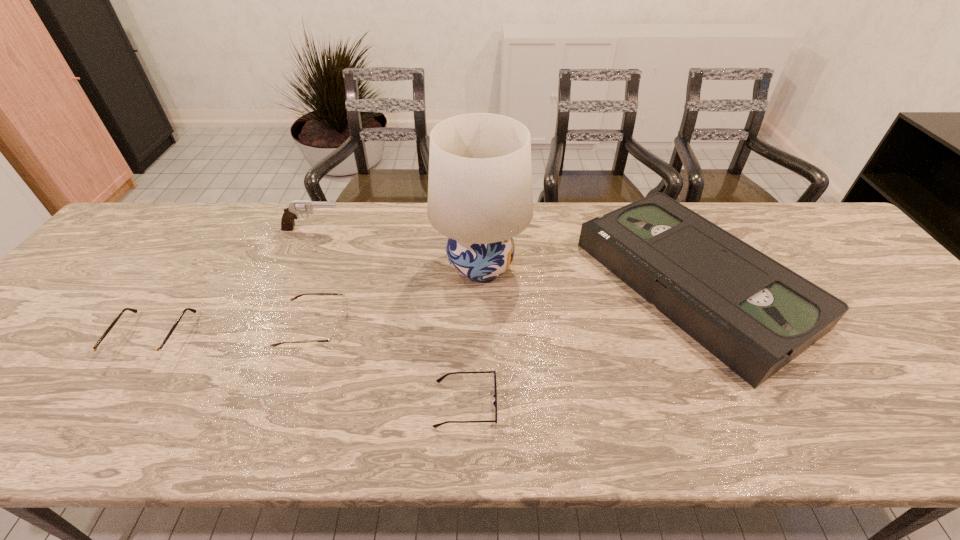
I want to click on free space located at the muzzle of the gun, so click(474, 230).

At what (x,y) coordinates should I click in order to perform the action: click on free spot located 0.100m on the right of the fourth shortest object. Please return your answer as a coordinate pair (x, y). Looking at the image, I should click on (836, 284).

At what (x,y) coordinates should I click in order to perform the action: click on free region located 0.150m at the hinge ends of the leftmost spectacles. Please return your answer as a coordinate pair (x, y). The width and height of the screenshot is (960, 540). Looking at the image, I should click on (92, 427).

Find the location of a particular element. vacant region located 0.390m on the front-facing side of the second spectacles from left to right is located at coordinates coord(508,328).

The width and height of the screenshot is (960, 540). Find the location of `vacant space located 0.210m on the front-facing side of the rightmost spectacles`. vacant space located 0.210m on the front-facing side of the rightmost spectacles is located at coordinates (598, 404).

Locate an element on the screen. This screenshot has width=960, height=540. lampshade present at the far edge is located at coordinates (480, 196).

Find the location of a particular element. The image size is (960, 540). gun that is at the far edge is located at coordinates (296, 207).

Identify the location of videotape situated at the far edge. This screenshot has height=540, width=960. (755, 315).

Where is `object situated at the near edge`? Image resolution: width=960 pixels, height=540 pixels. object situated at the near edge is located at coordinates (440, 379).

The width and height of the screenshot is (960, 540). In order to click on vacant space at the far edge in this screenshot , I will do point(180,249).